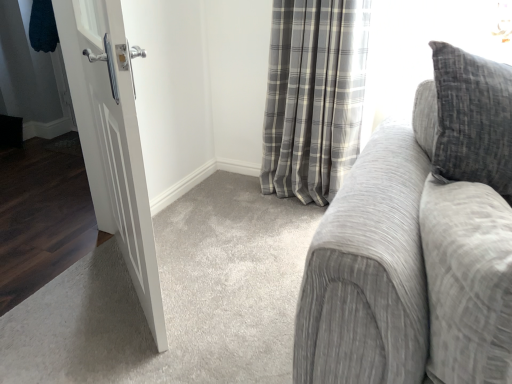
In order to face gray plaid curtain at center, should I rotate leftwards or rightwards?

It's best to rotate right around 6.871 degrees.

What do you see at coordinates (314, 96) in the screenshot?
I see `gray plaid curtain at center` at bounding box center [314, 96].

Locate an element on the screen. The height and width of the screenshot is (384, 512). textured gray couch at right is located at coordinates (419, 243).

In terms of width, does gray plaid curtain at center look wider or thinner when compared to white matte door at left?

gray plaid curtain at center is wider than white matte door at left.

What's the angular difference between gray plaid curtain at center and white matte door at left's facing directions?

There is a 35.5-degree angle between the facing directions of gray plaid curtain at center and white matte door at left.

Who is shorter, gray plaid curtain at center or white matte door at left?

gray plaid curtain at center is shorter.

Is white matte door at left completely or partially inside gray plaid curtain at center?

No, white matte door at left is not inside gray plaid curtain at center.

From a real-world perspective, which is physically below, gray plaid curtain at center or textured gray couch at right?

gray plaid curtain at center.

Where is `studio couch below the gray plaid curtain at center (from the image's perspective)`? studio couch below the gray plaid curtain at center (from the image's perspective) is located at coordinates (419, 243).

From a real-world perspective, relative to textured gray couch at right, is white matte door at left vertically above or below?

Clearly, from a real-world perspective, white matte door at left is below textured gray couch at right.

Can you confirm if white matte door at left is wider than textured gray couch at right?

No.

Find the location of a particular element. This screenshot has height=384, width=512. studio couch that appears on the right of white matte door at left is located at coordinates (419, 243).

From their relative heights in the image, would you say white matte door at left is taller or shorter than textured gray couch at right?

Considering their sizes, white matte door at left has more height than textured gray couch at right.

This screenshot has height=384, width=512. Find the location of `studio couch above the white matte door at left (from the image's perspective)`. studio couch above the white matte door at left (from the image's perspective) is located at coordinates (419, 243).

Between textured gray couch at right and white matte door at left, which one appears on the right side from the viewer's perspective?

textured gray couch at right.

Is white matte door at left inside textured gray couch at right?

No, white matte door at left is not inside textured gray couch at right.

Can you confirm if textured gray couch at right is thinner than gray plaid curtain at center?

No.

How much distance is there between textured gray couch at right and gray plaid curtain at center?

A: textured gray couch at right and gray plaid curtain at center are 3.56 feet apart from each other.

In the scene shown: Can we say textured gray couch at right lies outside gray plaid curtain at center?

Yes, textured gray couch at right is located beyond the bounds of gray plaid curtain at center.

Is textured gray couch at right facing away from gray plaid curtain at center?

Yes, textured gray couch at right is positioned with its back facing gray plaid curtain at center.

Can you see white matte door at left touching gray plaid curtain at center?

They are not placed beside each other.

From a real-world perspective, is white matte door at left on gray plaid curtain at center?

Yes, from a real-world perspective, white matte door at left is on top of gray plaid curtain at center.

Considering the sizes of objects white matte door at left and gray plaid curtain at center in the image provided, who is taller, white matte door at left or gray plaid curtain at center?

white matte door at left is taller.

Where is `curtain that is on the right side of white matte door at left`? This screenshot has width=512, height=384. curtain that is on the right side of white matte door at left is located at coordinates (314, 96).

Find the location of a particular element. curtain lying on the left of textured gray couch at right is located at coordinates (314, 96).

From the image, which object appears to be farther from gray plaid curtain at center, textured gray couch at right or white matte door at left?

textured gray couch at right lies further to gray plaid curtain at center than the other object.

Considering their positions, is white matte door at left positioned closer to gray plaid curtain at center than textured gray couch at right?

white matte door at left.

Looking at the image, which one is located further to textured gray couch at right, white matte door at left or gray plaid curtain at center?

gray plaid curtain at center is further to textured gray couch at right.

Which object lies further to the anchor point textured gray couch at right, gray plaid curtain at center or white matte door at left?

gray plaid curtain at center is further to textured gray couch at right.

Considering their positions, is textured gray couch at right positioned closer to white matte door at left than gray plaid curtain at center?

textured gray couch at right is closer to white matte door at left.

When comparing their distances from white matte door at left, does gray plaid curtain at center or textured gray couch at right seem closer?

textured gray couch at right is positioned closer to the anchor white matte door at left.

Locate an element on the screen. The image size is (512, 384). door between textured gray couch at right and gray plaid curtain at center from front to back is located at coordinates (112, 140).